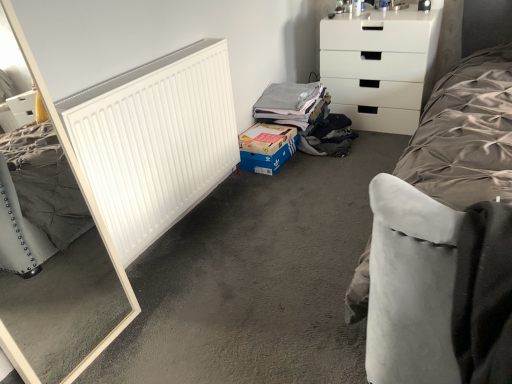
Find the location of a particular element. The image size is (512, 384). smooth gray carpet at center is located at coordinates (256, 280).

You are a GUI agent. You are given a task and a screenshot of the screen. Output one action in this format:
    pyautogui.click(x=<x>, y=<y>)
    Task: Click on the white glossy chest of drawers at upper right
    This screenshot has height=384, width=512.
    Given the screenshot: What is the action you would take?
    pyautogui.click(x=379, y=66)

You are a GUI agent. You are given a task and a screenshot of the screen. Output one action in this format:
    pyautogui.click(x=<x>, y=<y>)
    Task: Click on the cardboard box at lower center
    The height and width of the screenshot is (384, 512).
    Given the screenshot: What is the action you would take?
    pyautogui.click(x=266, y=148)

The width and height of the screenshot is (512, 384). What are the coordinates of `smooth gray carpet at center` in the screenshot? It's located at point(256,280).

Is cardboard box at lower center taller than smooth gray carpet at center?

Yes, cardboard box at lower center is taller than smooth gray carpet at center.

Considering the relative sizes of cardboard box at lower center and smooth gray carpet at center in the image provided, is cardboard box at lower center thinner than smooth gray carpet at center?

Indeed, cardboard box at lower center has a lesser width compared to smooth gray carpet at center.

From a real-world perspective, which is physically above, cardboard box at lower center or smooth gray carpet at center?

From a 3D spatial view, cardboard box at lower center is above.

Is cardboard box at lower center to the right of white glossy chest of drawers at upper right from the viewer's perspective?

No, cardboard box at lower center is not to the right of white glossy chest of drawers at upper right.

Which object is closer to the camera, cardboard box at lower center or white glossy chest of drawers at upper right?

white glossy chest of drawers at upper right is closer to the camera.

Can you confirm if cardboard box at lower center is smaller than white glossy chest of drawers at upper right?

Correct, cardboard box at lower center occupies less space than white glossy chest of drawers at upper right.

Is white matte radiator at left smaller than smooth gray carpet at center?

Yes.

Where is `concrete below the white matte radiator at left (from the image's perspective)`? concrete below the white matte radiator at left (from the image's perspective) is located at coordinates (256, 280).

Considering the relative sizes of white matte radiator at left and smooth gray carpet at center in the image provided, is white matte radiator at left taller than smooth gray carpet at center?

Correct, white matte radiator at left is much taller as smooth gray carpet at center.

Does point (155, 189) appear closer or farther from the camera than point (199, 225)?

Clearly, point (155, 189) is closer to the camera than point (199, 225).

Is white glossy chest of drawers at upper right surrounding cardboard box at lower center?

Actually, cardboard box at lower center is outside white glossy chest of drawers at upper right.

Between white glossy chest of drawers at upper right and cardboard box at lower center, which one appears on the left side from the viewer's perspective?

cardboard box at lower center.

In the scene shown: From a real-world perspective, is white glossy chest of drawers at upper right over cardboard box at lower center?

Yes, from a real-world perspective, white glossy chest of drawers at upper right is above cardboard box at lower center.

How many degrees apart are the facing directions of white glossy chest of drawers at upper right and cardboard box at lower center?

white glossy chest of drawers at upper right and cardboard box at lower center are facing 88 degrees away from each other.

From the image's perspective, is cardboard box at lower center over white matte radiator at left?

Indeed, from the image's perspective, cardboard box at lower center is shown above white matte radiator at left.

Which is nearer, [285,133] or [155,179]?

Point [155,179]

From a real-world perspective, which is physically above, cardboard box at lower center or white matte radiator at left?

white matte radiator at left, from a real-world perspective.

This screenshot has height=384, width=512. What are the coordinates of `radiator that appears below the cardboard box at lower center (from the image's perspective)` in the screenshot? It's located at (155, 141).

Does smooth gray carpet at center have a lesser width compared to white matte radiator at left?

Incorrect, the width of smooth gray carpet at center is not less than that of white matte radiator at left.

Can you confirm if smooth gray carpet at center is shorter than white matte radiator at left?

Correct, smooth gray carpet at center is not as tall as white matte radiator at left.

Is white matte radiator at left inside smooth gray carpet at center?

No, white matte radiator at left is located outside of smooth gray carpet at center.

You are a GUI agent. You are given a task and a screenshot of the screen. Output one action in this format:
    pyautogui.click(x=<x>, y=<y>)
    Task: Click on the concrete that is under the white matte radiator at left (from a real-world perspective)
    The width and height of the screenshot is (512, 384).
    Given the screenshot: What is the action you would take?
    pyautogui.click(x=256, y=280)

Is smooth gray carpet at center directly adjacent to white glossy chest of drawers at upper right?

smooth gray carpet at center and white glossy chest of drawers at upper right are clearly separated.

Which object is closer to the camera, smooth gray carpet at center or white glossy chest of drawers at upper right?

smooth gray carpet at center.

Is smooth gray carpet at center bigger than white glossy chest of drawers at upper right?

Actually, smooth gray carpet at center might be smaller than white glossy chest of drawers at upper right.

There is a smooth gray carpet at center. Where is `cardboard box above it (from a real-world perspective)`? cardboard box above it (from a real-world perspective) is located at coordinates (266, 148).

You are a GUI agent. You are given a task and a screenshot of the screen. Output one action in this format:
    pyautogui.click(x=<x>, y=<y>)
    Task: Click on the cardboard box below the white glossy chest of drawers at upper right (from a real-world perspective)
    This screenshot has width=512, height=384.
    Given the screenshot: What is the action you would take?
    pyautogui.click(x=266, y=148)

From the image, which object appears to be nearer to smooth gray carpet at center, cardboard box at lower center or white matte radiator at left?

white matte radiator at left.

Which object lies nearer to the anchor point white glossy chest of drawers at upper right, smooth gray carpet at center or cardboard box at lower center?

cardboard box at lower center lies closer to white glossy chest of drawers at upper right than the other object.

When comparing their distances from white matte radiator at left, does white glossy chest of drawers at upper right or cardboard box at lower center seem closer?

cardboard box at lower center is positioned closer to the anchor white matte radiator at left.

From the image, which object appears to be nearer to smooth gray carpet at center, cardboard box at lower center or white glossy chest of drawers at upper right?

cardboard box at lower center is positioned closer to the anchor smooth gray carpet at center.

From the image, which object appears to be farther from cardboard box at lower center, white matte radiator at left or smooth gray carpet at center?

Based on the image, white matte radiator at left appears to be further to cardboard box at lower center.

Looking at the image, which one is located closer to white matte radiator at left, white glossy chest of drawers at upper right or smooth gray carpet at center?

smooth gray carpet at center is closer to white matte radiator at left.

From the image, which object appears to be farther from smooth gray carpet at center, white glossy chest of drawers at upper right or cardboard box at lower center?

white glossy chest of drawers at upper right is further to smooth gray carpet at center.

When comparing their distances from white glossy chest of drawers at upper right, does cardboard box at lower center or white matte radiator at left seem further?

Among the two, white matte radiator at left is located further to white glossy chest of drawers at upper right.

Locate an element on the screen. The height and width of the screenshot is (384, 512). cardboard box situated between white matte radiator at left and white glossy chest of drawers at upper right from left to right is located at coordinates (266, 148).

Locate an element on the screen. radiator between smooth gray carpet at center and cardboard box at lower center from front to back is located at coordinates (155, 141).

Image resolution: width=512 pixels, height=384 pixels. I want to click on the chest of drawers positioned between smooth gray carpet at center and cardboard box at lower center from near to far, so click(379, 66).

I want to click on radiator between smooth gray carpet at center and white glossy chest of drawers at upper right in the front-back direction, so click(155, 141).